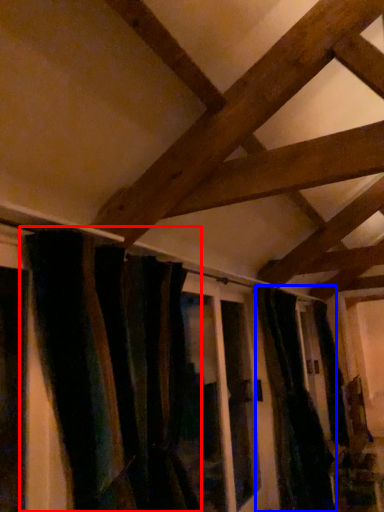
Question: Which of the following is the farthest to the observer, curtain (highlighted by a red box) or curtain (highlighted by a blue box)?

Choices:
 (A) curtain
 (B) curtain

Answer: (B)